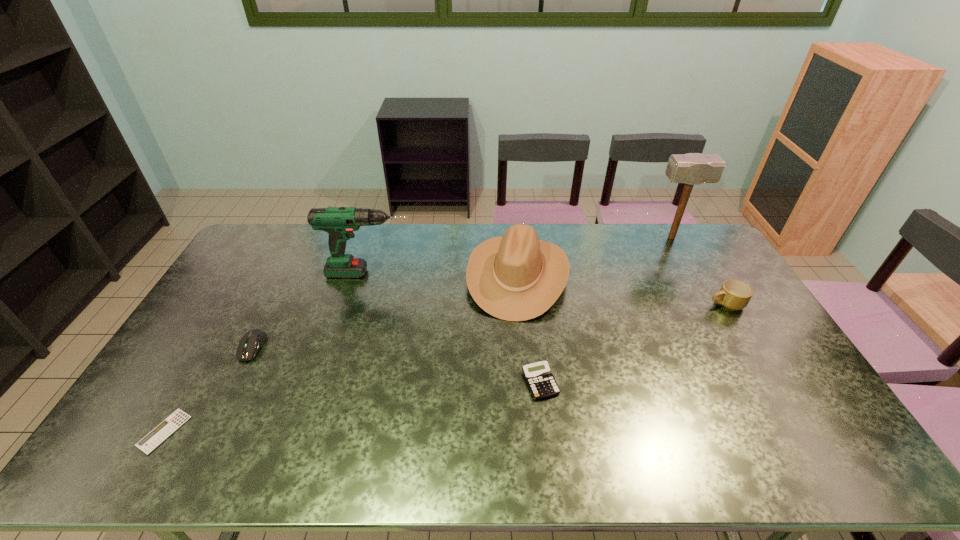
I want to click on free space at the far edge, so click(655, 242).

This screenshot has height=540, width=960. In the image, there is a desktop. Find the location of `vacant space at the near edge`. vacant space at the near edge is located at coordinates (394, 443).

In the image, there is a desktop. Where is `free space at the left edge`? free space at the left edge is located at coordinates coord(201,367).

Locate an element on the screen. The image size is (960, 540). free spot at the right edge of the desktop is located at coordinates (770, 384).

I want to click on free area in between the mallet and the fifth shortest object, so click(594, 256).

Find the location of a particular element. free area in between the computer equipment and the shorter calculator is located at coordinates (208, 389).

Image resolution: width=960 pixels, height=540 pixels. Identify the location of vacant area that lies between the shortest object and the third tallest object. (341, 353).

Find the location of a particular element. The height and width of the screenshot is (540, 960). vacant region between the third object from left to right and the taller calculator is located at coordinates (455, 328).

This screenshot has height=540, width=960. I want to click on vacant region between the third tallest object and the right calculator, so click(529, 329).

Find the location of a particular element. The image size is (960, 540). blank region between the cowboy hat and the shortest object is located at coordinates (341, 353).